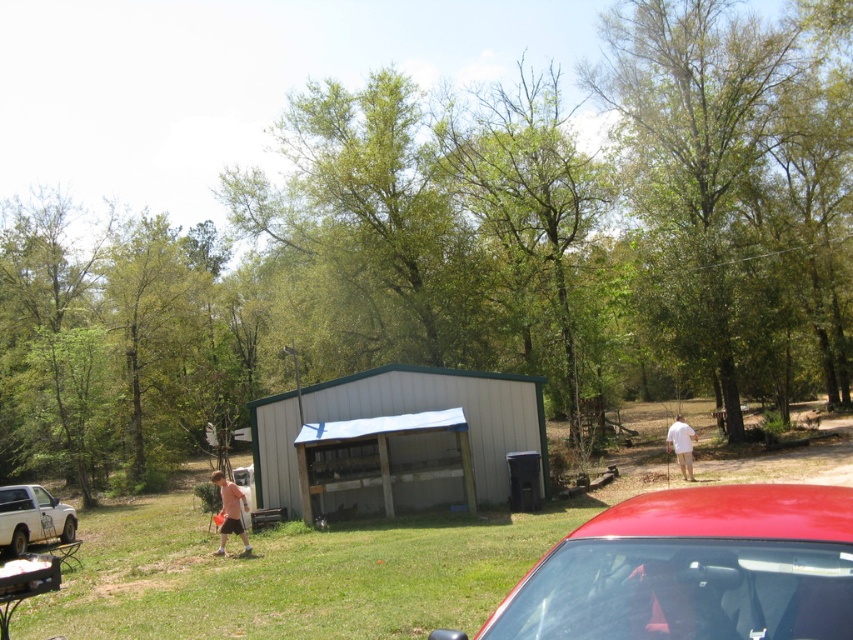
You are driving a car and see the white matte truck at lower left and the matte pink shorts at center. Which object is positioned further to the left in the scene?

The white matte truck at lower left is positioned further to the left than the matte pink shorts at center.

You are standing at the point marked as point (396, 440) in the image. What object is directly in front of you?

The gray metal shed at center is directly in front of you at point (396, 440).

You are driving a delivery van that is 2 meters wide and need to pass between the shiny red car at lower right and the white matte truck at lower left. Can your van fit through the space between them?

The shiny red car at lower right might be wider than white matte truck at lower left. If the red car is indeed wider, the total space between them could be narrower than 2 meters, so the van might not fit. However, if the red car is not significantly wider, there might be enough space. Without exact measurements, it is uncertain.